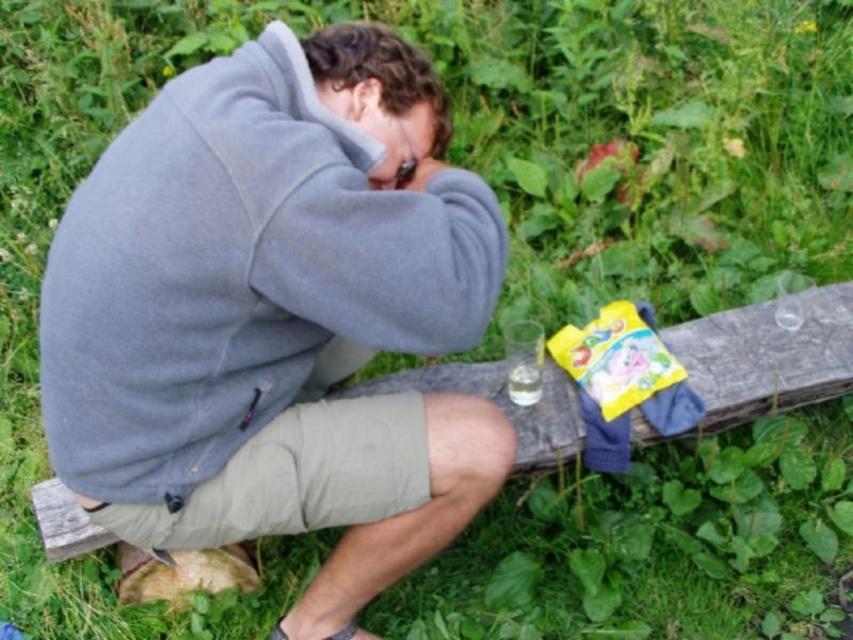
Question: Which point is closer to the camera taking this photo?

Choices:
 (A) [457, 220]
 (B) [706, 413]

Answer: (A)

Question: Which point is farther to the camera?

Choices:
 (A) pyautogui.click(x=700, y=392)
 (B) pyautogui.click(x=364, y=362)

Answer: (B)

Question: Does gray fleece jacket at center have a lesser width compared to wooden bench at center?

Choices:
 (A) no
 (B) yes

Answer: (B)

Question: Is the position of gray fleece jacket at center less distant than that of wooden bench at center?

Choices:
 (A) no
 (B) yes

Answer: (B)

Question: Can you confirm if gray fleece jacket at center is positioned to the left of wooden bench at center?

Choices:
 (A) yes
 (B) no

Answer: (A)